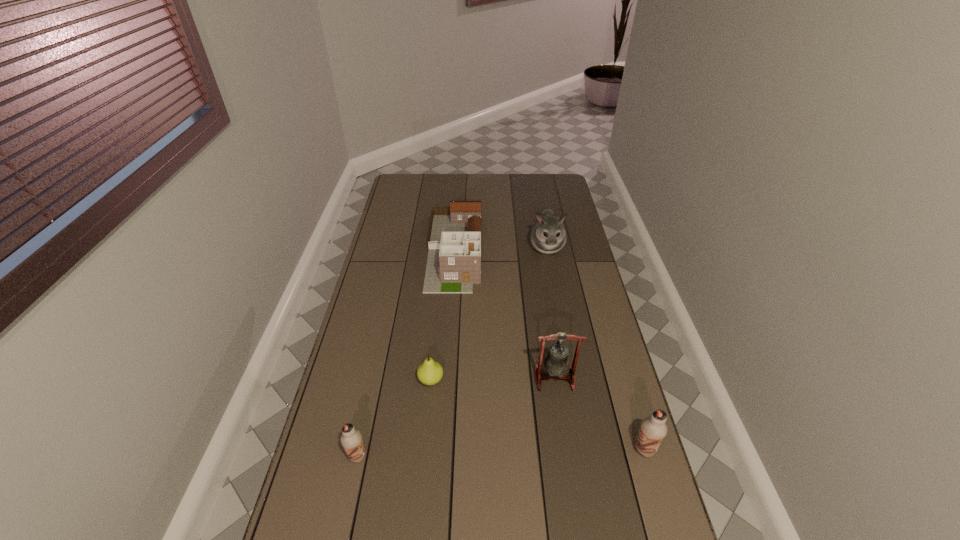
Identify the location of vacant space located at the main entrance of the dollhouse. (448, 352).

The width and height of the screenshot is (960, 540). Find the location of `free spot located 0.360m on the back of the shortest object`. free spot located 0.360m on the back of the shortest object is located at coordinates (440, 294).

At what (x,y) coordinates should I click in order to perform the action: click on vacant space located on the front of the bell. Please return your answer as a coordinate pair (x, y). The width and height of the screenshot is (960, 540). Looking at the image, I should click on (559, 406).

You are a GUI agent. You are given a task and a screenshot of the screen. Output one action in this format:
    pyautogui.click(x=<x>, y=<y>)
    Task: Click on the vacant space located on the face of the hamster
    This screenshot has width=960, height=540.
    Given the screenshot: What is the action you would take?
    pyautogui.click(x=556, y=295)

Where is `object that is at the left edge`? This screenshot has height=540, width=960. object that is at the left edge is located at coordinates (351, 439).

Identify the location of chocolate milk that is positioned at the right edge. (653, 429).

Image resolution: width=960 pixels, height=540 pixels. I want to click on bell situated at the right edge, so click(556, 364).

The image size is (960, 540). I want to click on hamster at the right edge, so click(x=548, y=235).

Where is `vacant space at the far edge of the desktop`? vacant space at the far edge of the desktop is located at coordinates (470, 194).

Where is `vacant region at the near edge of the desktop`? This screenshot has height=540, width=960. vacant region at the near edge of the desktop is located at coordinates (561, 516).